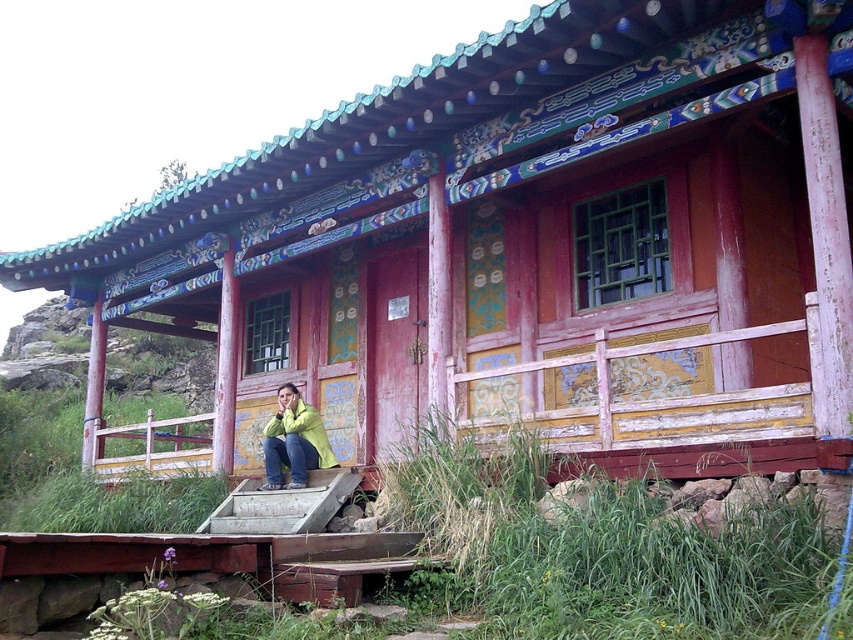
Question: Which point is closer to the camera?

Choices:
 (A) green matte jacket at lower center
 (B) wooden stairs at center

Answer: (B)

Question: Does wooden stairs at center have a larger size compared to green matte jacket at lower center?

Choices:
 (A) yes
 (B) no

Answer: (A)

Question: From the image, what is the correct spatial relationship of wooden stairs at center in relation to green matte jacket at lower center?

Choices:
 (A) above
 (B) below

Answer: (B)

Question: Can you confirm if wooden stairs at center is smaller than green matte jacket at lower center?

Choices:
 (A) yes
 (B) no

Answer: (B)